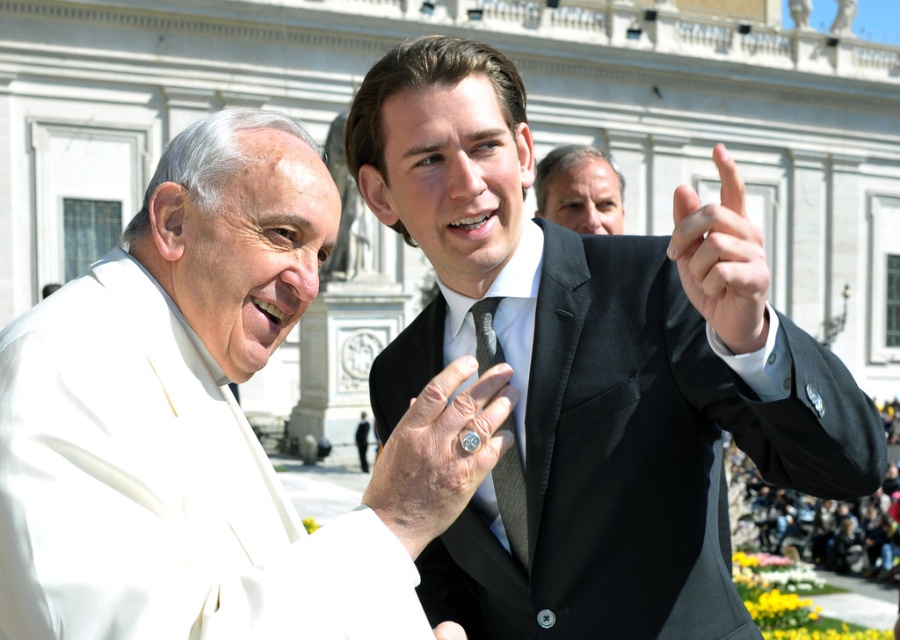
You are an artist trying to sketch this scene. You want to ensure the black satin suit at center and the silver metallic ring at center are proportionally accurate. Which object should you draw first to maintain proper scale?

The silver metallic ring at center should be drawn first since it is taller than the black satin suit at center, ensuring the scale is correctly proportioned.

You are a photographer standing at the camera position. You want to take a closeup photo of the silver metallic ring at center. Can you reach it without moving from your current position?

The silver metallic ring at center is 23.10 meters away from camera. Since it is too far away, you cannot reach it without moving closer.

You are a photographer trying to capture a closeup of the silver metallic ring at center and the black silk hand at upper right. Which object should you zoom in on to ensure both are in focus without moving the camera?

The silver metallic ring at center is shorter than the black silk hand at upper right, so you should zoom in on the silver metallic ring at center to ensure both are in focus without moving the camera.